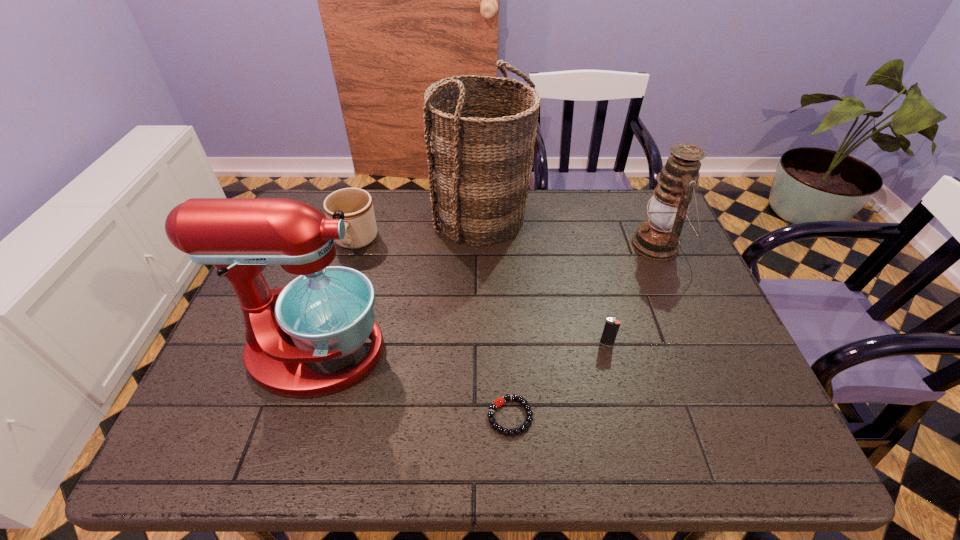
Where is `free space located on the front of the lantern`? free space located on the front of the lantern is located at coordinates (684, 308).

Locate an element on the screen. The image size is (960, 540). vacant area situated 0.110m on the side of the fourth tallest object with the handle is located at coordinates (340, 291).

Find the location of `vacant space located on the front of the fifth tallest object`. vacant space located on the front of the fifth tallest object is located at coordinates (626, 423).

Identify the location of vacant point located on the left of the bracelet. (390, 416).

Where is `basket that is at the far edge`? basket that is at the far edge is located at coordinates (480, 148).

Identify the location of lantern at the far edge. The height and width of the screenshot is (540, 960). (658, 238).

Where is `mug that is at the far edge`? mug that is at the far edge is located at coordinates (360, 224).

You are a GUI agent. You are given a task and a screenshot of the screen. Output one action in this format:
    pyautogui.click(x=<x>, y=<y>)
    Task: Click on the object situated at the near edge
    The height and width of the screenshot is (540, 960).
    Given the screenshot: What is the action you would take?
    pyautogui.click(x=511, y=432)

In order to click on mixer at the left edge in this screenshot , I will do `click(326, 313)`.

In order to click on mug that is at the left edge in this screenshot , I will do `click(360, 224)`.